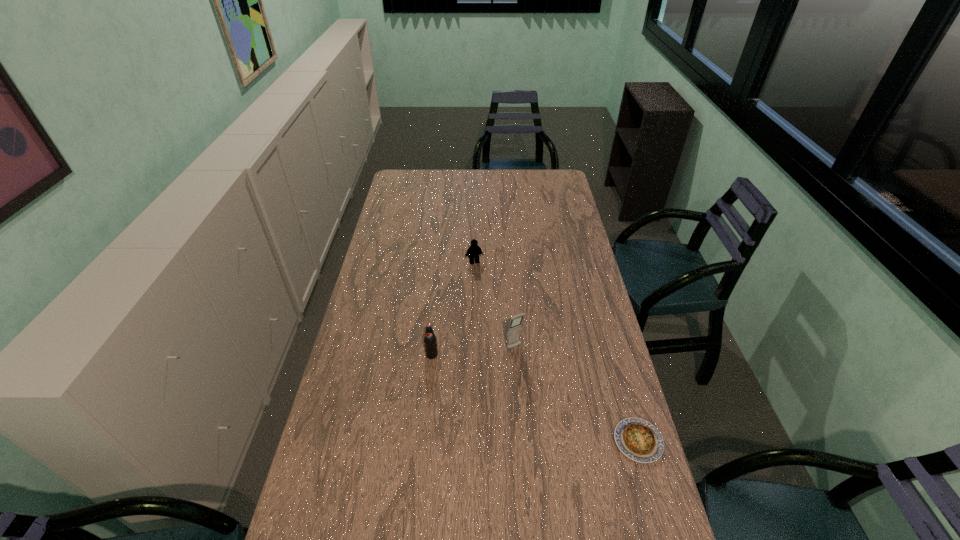
Where is `free space on the desktop that is between the pop and the rightmost object and is positioned on the front-facing side of the second object from right to left`? This screenshot has width=960, height=540. free space on the desktop that is between the pop and the rightmost object and is positioned on the front-facing side of the second object from right to left is located at coordinates click(x=555, y=406).

You are a GUI agent. You are given a task and a screenshot of the screen. Output one action in this format:
    pyautogui.click(x=<x>, y=<y>)
    Task: Click on the free spot on the desktop that is between the leftmost object and the rightmost object and is positioned on the face of the farthest object
    Image resolution: width=960 pixels, height=540 pixels.
    Given the screenshot: What is the action you would take?
    pyautogui.click(x=517, y=390)